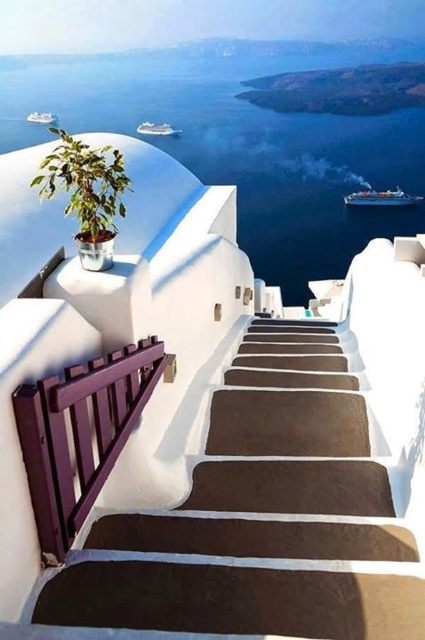
Does brown smooth stairs at center have a smaller size compared to white glossy boat at upper left?

No, brown smooth stairs at center is not smaller than white glossy boat at upper left.

In order to click on brown smooth stairs at center in this screenshot , I will do `click(252, 538)`.

Between blue water at upper center and white glossy cruise ship at upper center, which one is positioned higher?

blue water at upper center is above.

Which is behind, point (402, 182) or point (152, 132)?

Positioned behind is point (152, 132).

Between point (14, 61) and point (161, 134), which one is positioned behind?

The point (14, 61) is more distant.

I want to click on blue water at upper center, so click(243, 141).

Does blue water at upper center appear over purple wood rail at left?

Indeed, blue water at upper center is positioned over purple wood rail at left.

Where is `blue water at upper center`? blue water at upper center is located at coordinates (243, 141).

Locate an element on the screen. The image size is (425, 640). blue water at upper center is located at coordinates (243, 141).